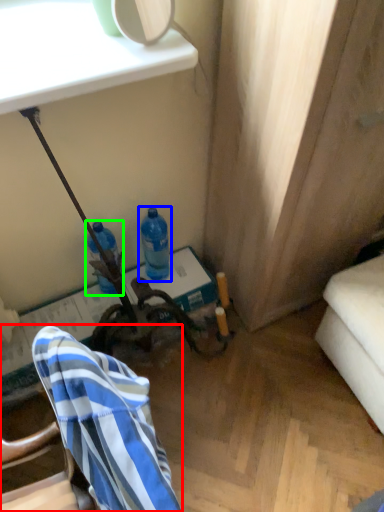
Question: Based on their relative distances, which object is farther from chair (highlighted by a red box)? Choose from bottle (highlighted by a blue box) and bottle (highlighted by a green box).

Choices:
 (A) bottle
 (B) bottle

Answer: (A)